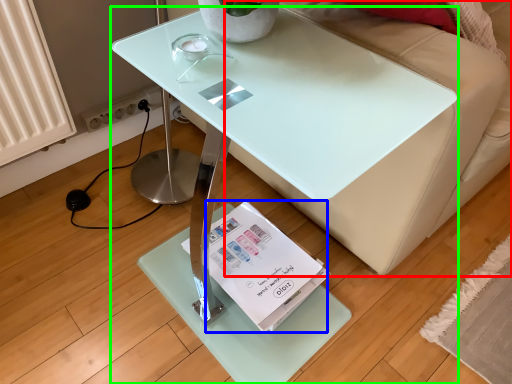
Question: Which is nearer to the couch (highlighted by a red box)? magazine (highlighted by a blue box) or table (highlighted by a green box).

Choices:
 (A) magazine
 (B) table

Answer: (B)